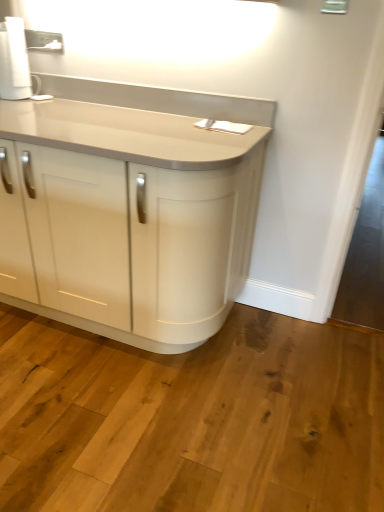
Question: Considering the positions of point (9, 65) and point (97, 206), is point (9, 65) closer or farther from the camera than point (97, 206)?

Choices:
 (A) closer
 (B) farther

Answer: (B)

Question: From the image's perspective, is white matte paper towel at upper left positioned above or below matte white cabinet at center?

Choices:
 (A) below
 (B) above

Answer: (B)

Question: Would you say white matte paper towel at upper left is to the left or to the right of matte white cabinet at center in the picture?

Choices:
 (A) right
 (B) left

Answer: (B)

Question: Based on their positions, is matte white cabinet at center located to the left or right of white matte paper towel at upper left?

Choices:
 (A) right
 (B) left

Answer: (A)

Question: Considering the positions of matte white cabinet at center and white matte paper towel at upper left in the image, is matte white cabinet at center bigger or smaller than white matte paper towel at upper left?

Choices:
 (A) small
 (B) big

Answer: (B)

Question: Looking at their shapes, would you say matte white cabinet at center is wider or thinner than white matte paper towel at upper left?

Choices:
 (A) wide
 (B) thin

Answer: (A)

Question: Do you think matte white cabinet at center is within white matte paper towel at upper left, or outside of it?

Choices:
 (A) inside
 (B) outside

Answer: (B)